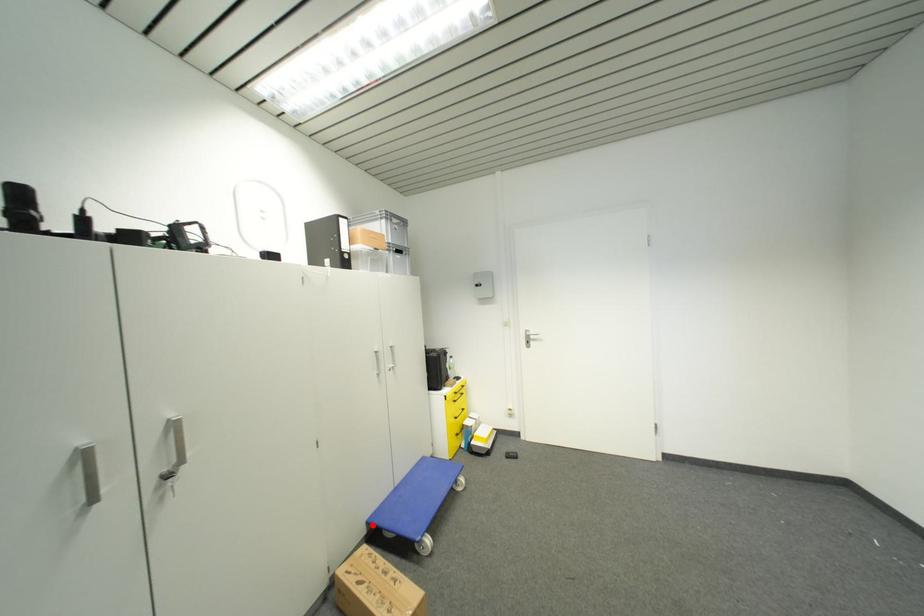
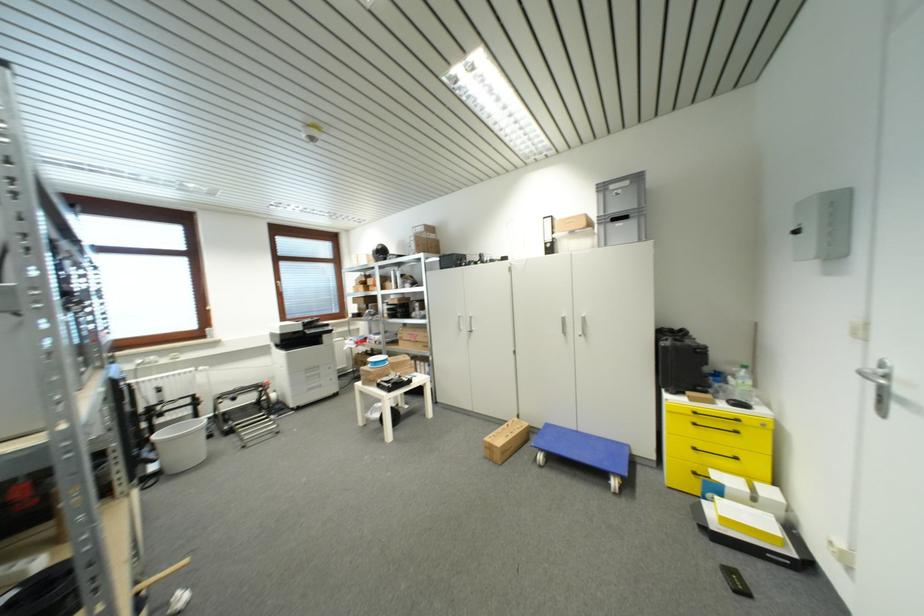
The point at the highlighted location is marked in the first image. Where is the corresponding point in the second image?

(552, 427)